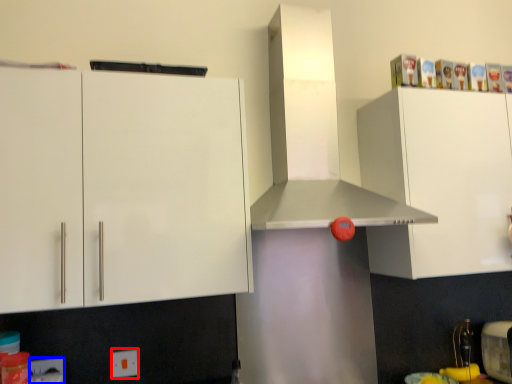
Question: Which point is further to the camera, electric outlet (highlighted by a red box) or electric outlet (highlighted by a blue box)?

Choices:
 (A) electric outlet
 (B) electric outlet

Answer: (A)